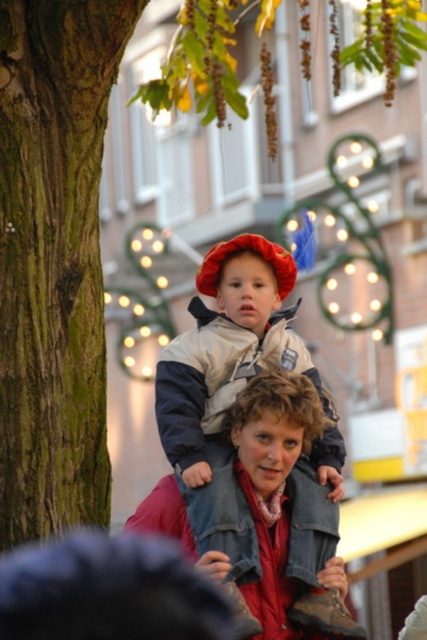
Who is positioned more to the left, matte blue jacket at center or black fuzzy hat at upper center?

black fuzzy hat at upper center is more to the left.

Is matte blue jacket at center to the right of black fuzzy hat at upper center from the viewer's perspective?

Correct, you'll find matte blue jacket at center to the right of black fuzzy hat at upper center.

The height and width of the screenshot is (640, 427). What do you see at coordinates (234, 356) in the screenshot?
I see `matte blue jacket at center` at bounding box center [234, 356].

I want to click on matte blue jacket at center, so [234, 356].

Does point (312, 464) come behind point (175, 372)?

Yes.

Is matte blue jacket at center smaller than gray fleece jacket at center?

No, matte blue jacket at center is not smaller than gray fleece jacket at center.

Measure the distance between matte blue jacket at center and camera.

matte blue jacket at center and camera are 208.73 feet apart from each other.

At what (x,y) coordinates should I click in order to perform the action: click on matte blue jacket at center. Please return your answer as a coordinate pair (x, y). Looking at the image, I should click on (234, 356).

Can you confirm if black fuzzy hat at upper center is positioned to the right of gray fleece jacket at center?

No, black fuzzy hat at upper center is not to the right of gray fleece jacket at center.

Does black fuzzy hat at upper center come in front of gray fleece jacket at center?

Yes, black fuzzy hat at upper center is closer to the viewer.

Does point (104, 618) come farther from viewer compared to point (202, 355)?

No, it is not.

Where is `black fuzzy hat at upper center`? The width and height of the screenshot is (427, 640). black fuzzy hat at upper center is located at coordinates (108, 589).